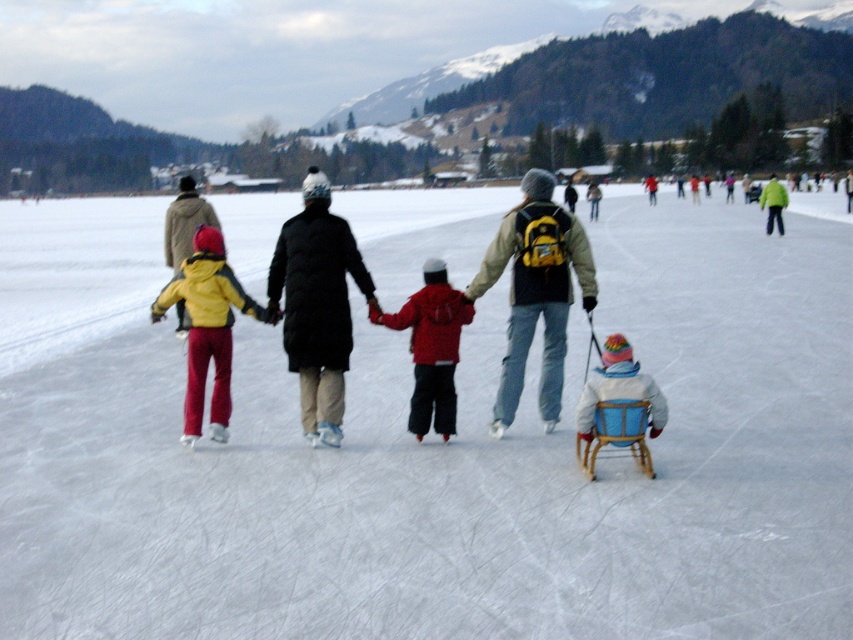
You are a photographer standing at the edge of the ice rink. You want to capture a photo of both the yellow matte jacket at left and the red matte jacket at center in the same frame. Based on their positions, which jacket should be placed closer to the camera to ensure both are fully visible?

The yellow matte jacket at left might be wider than red matte jacket at center, so to ensure both are fully visible in the photo, the red matte jacket at center should be placed closer to the camera.

You are standing at the point marked by the coordinates point (463,468). Looking around, you see the white smooth ice at center. Which direction should you skate to stay on the ice and avoid the mountainous landscape?

The white smooth ice at center is represented by point (463,468). To stay on the ice and avoid the mountainous landscape, you should skate towards the center of the rink where the ice is smooth and safe.